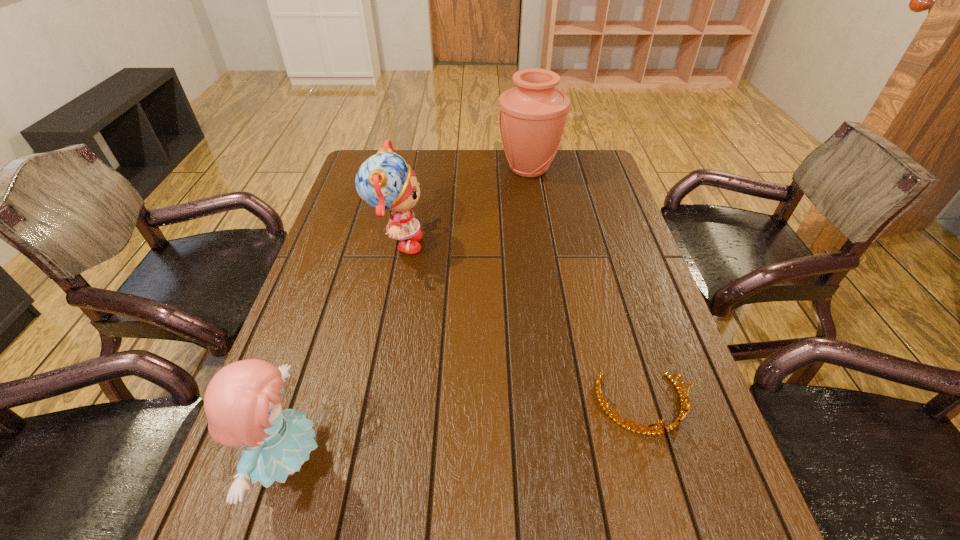
Where is `vacant space that's between the nearer doll and the farther doll`? The height and width of the screenshot is (540, 960). vacant space that's between the nearer doll and the farther doll is located at coordinates (344, 353).

The width and height of the screenshot is (960, 540). Identify the location of free spot between the farther doll and the farthest object. (463, 207).

Find the location of `free space between the nearer doll and the shortest object`. free space between the nearer doll and the shortest object is located at coordinates (466, 433).

At what (x,y) coordinates should I click in order to perform the action: click on vacant area between the second farthest object and the tiara. Please return your answer as a coordinate pair (x, y). Looking at the image, I should click on (519, 325).

Where is `free spot between the nearer doll and the shortest object`? free spot between the nearer doll and the shortest object is located at coordinates (466, 433).

Where is `unoccupied area between the nearer doll and the third nearest object`? This screenshot has width=960, height=540. unoccupied area between the nearer doll and the third nearest object is located at coordinates (344, 353).

At what (x,y) coordinates should I click in order to perform the action: click on unoccupied position between the tiara and the nearer doll. Please return your answer as a coordinate pair (x, y). Looking at the image, I should click on (466, 433).

Find the location of a particular element. vacant point located between the nearer doll and the third nearest object is located at coordinates (344, 353).

Locate an element on the screen. This screenshot has width=960, height=540. empty space that is in between the farthest object and the shortest object is located at coordinates (586, 287).

The width and height of the screenshot is (960, 540). In order to click on object that is the second closest one to the farthest object in this screenshot , I will do `click(648, 430)`.